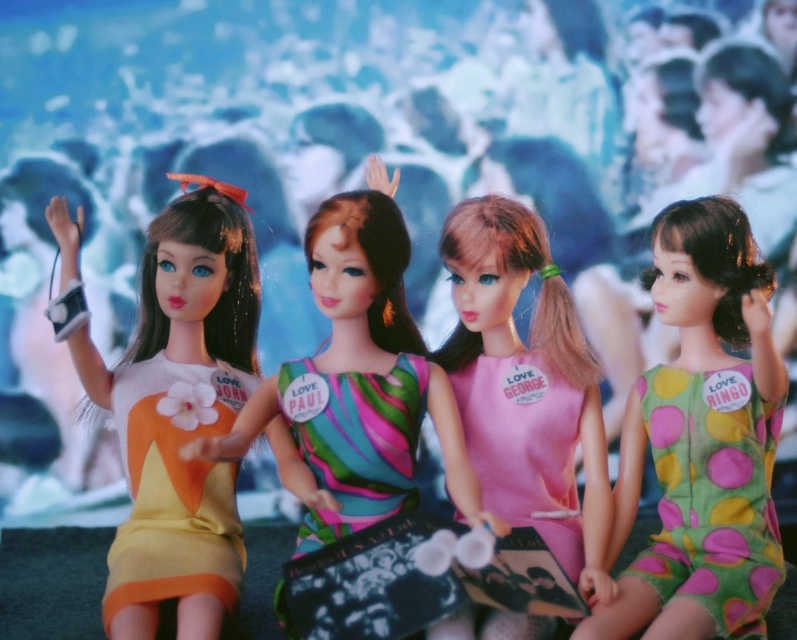
In the scene shown: You are setting up a display for a music festival. You have a matte plastic doll at left and a pink fabric dress at center. The display requires that these two items be placed exactly 16 inches apart. Based on the scene description, will their current positions meet this requirement?

The matte plastic doll at left and pink fabric dress at center are 16.15 inches apart from each other, which is slightly more than the required 16 inches. Therefore, their current positions do not exactly meet the requirement but are very close.

You are a photographer taking a picture of the matte plastic doll at left and the matte plastic doll at center. Which doll should you focus on first if you want to capture both in the frame?

You should focus on the matte plastic doll at left first because it is positioned to the left of the matte plastic doll at center, so capturing it first ensures both are in the frame.

In the scene shown: You are a photographer taking a picture of the green polka dot dress at center and the matte plastic doll at left. Which object should you focus on first if you want to capture both in the same frame without moving the camera?

The matte plastic doll at left should be focused on first because the green polka dot dress at center is positioned to its right, so adjusting focus from left to right would ensure both are in frame.